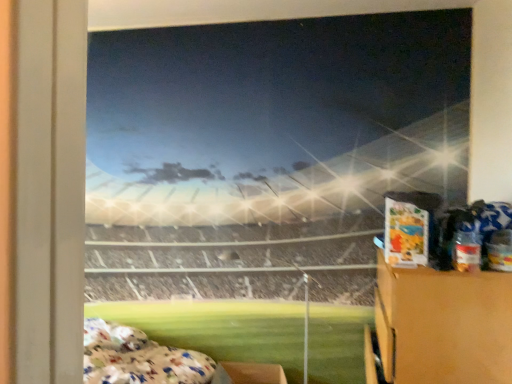
Where is `wooden cabinet at right`? The image size is (512, 384). wooden cabinet at right is located at coordinates (443, 325).

The image size is (512, 384). What do you see at coordinates (443, 325) in the screenshot?
I see `wooden cabinet at right` at bounding box center [443, 325].

What is the approximate height of wooden cabinet at right?

It is 89.38 centimeters.

This screenshot has height=384, width=512. Identify the location of wooden cabinet at right. (443, 325).